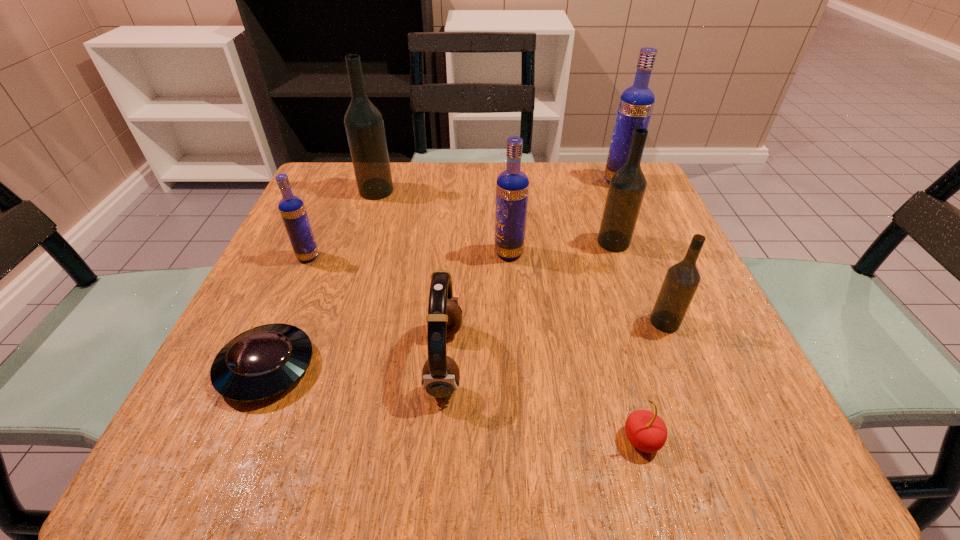
Locate an element on the screen. The width and height of the screenshot is (960, 540). cherry positioned at the right edge is located at coordinates (646, 431).

In order to click on object positioned at the far left corner in this screenshot , I will do `click(364, 125)`.

Identify the location of object that is at the near left corner. (258, 364).

Where is `object that is at the far right corner`? Image resolution: width=960 pixels, height=540 pixels. object that is at the far right corner is located at coordinates (636, 103).

Find the location of `object that is positioned at the near right corner`. object that is positioned at the near right corner is located at coordinates (646, 431).

The image size is (960, 540). In the image, there is a desktop. What are the coordinates of `free space at the far edge` in the screenshot? It's located at (532, 167).

Image resolution: width=960 pixels, height=540 pixels. What are the coordinates of `vacant space at the right edge` in the screenshot? It's located at (689, 351).

Image resolution: width=960 pixels, height=540 pixels. In the image, there is a desktop. Identify the location of blank space at the far left corner. (335, 168).

This screenshot has width=960, height=540. What are the coordinates of `free space between the fourth vodka from right to left and the fourth object from left to right` in the screenshot? It's located at (477, 307).

This screenshot has width=960, height=540. I want to click on vacant point located between the second nearest black vodka and the smallest blue vodka, so click(461, 249).